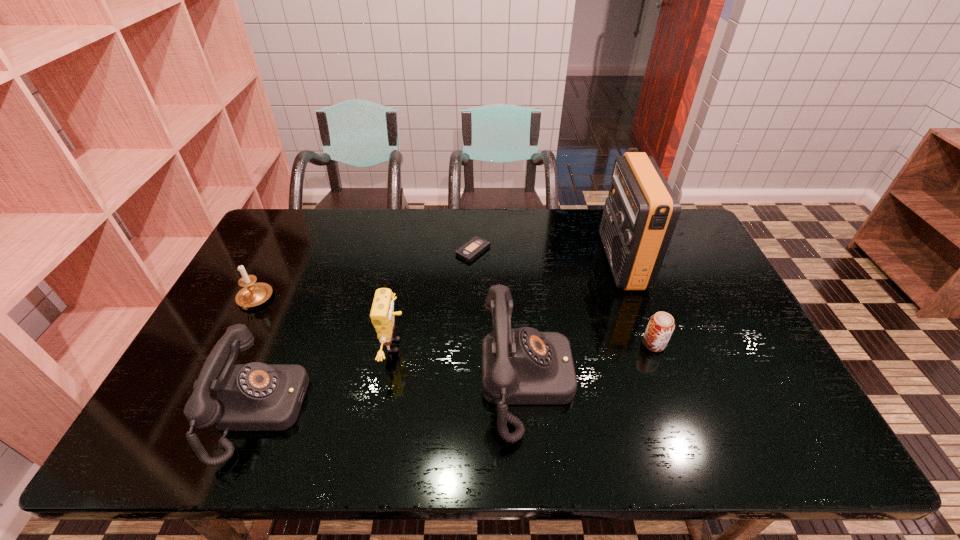
Locate an element on the screen. The width and height of the screenshot is (960, 540). vacant space that is in between the fifth object from right to left and the videotape is located at coordinates (434, 298).

Where is `unoccupied position between the second shortest object and the leftmost object`? unoccupied position between the second shortest object and the leftmost object is located at coordinates (454, 322).

Image resolution: width=960 pixels, height=540 pixels. I want to click on free space that is in between the right telephone and the sponge, so click(462, 363).

Find the location of a particular element. This screenshot has width=960, height=540. the fourth closest object to the sixth tallest object is located at coordinates (382, 314).

Locate an element on the screen. object that ranks as the sixth closest to the radio receiver is located at coordinates click(253, 294).

You are a GUI agent. You are given a task and a screenshot of the screen. Output one action in this format:
    pyautogui.click(x=<x>, y=<y>)
    Task: Click on the free spot that satisfies the following two spatial constraints: 1. on the front-facing side of the tallest object; 2. on the right side of the second shortest object
    The image size is (960, 540).
    Given the screenshot: What is the action you would take?
    pyautogui.click(x=652, y=344)

You are a GUI agent. You are given a task and a screenshot of the screen. Output one action in this format:
    pyautogui.click(x=<x>, y=<y>)
    Task: Click on the free space that satisfies the following two spatial constraints: 1. on the front side of the sixth tallest object; 2. on the dial of the taller telephone
    
    Given the screenshot: What is the action you would take?
    pyautogui.click(x=667, y=381)

Where is `vacant space that satisfies the following two spatial constraints: 1. with a handle on the side of the beer can; 2. on the left side of the fifth tallest object`? This screenshot has width=960, height=540. vacant space that satisfies the following two spatial constraints: 1. with a handle on the side of the beer can; 2. on the left side of the fifth tallest object is located at coordinates (231, 344).

I want to click on free point that satisfies the following two spatial constraints: 1. with a handle on the side of the second shortest object; 2. on the right side of the candle holder, so [231, 344].